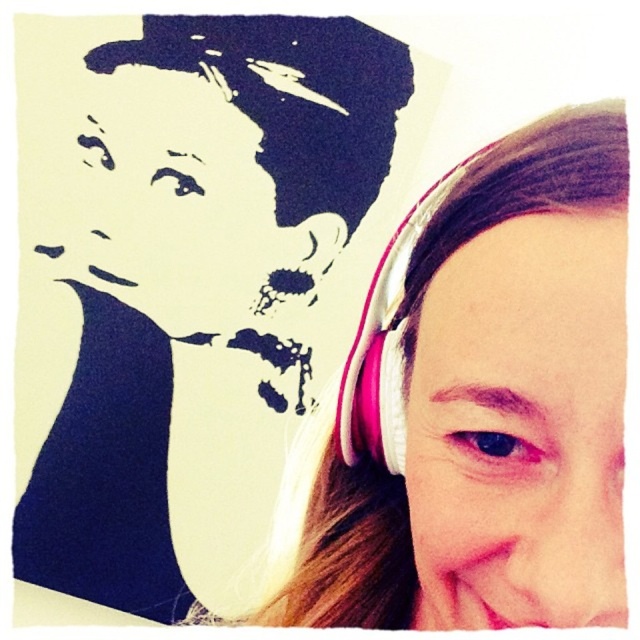
Question: Does pink matte headphones at right lie in front of pink fabric earphone at upper right?

Choices:
 (A) no
 (B) yes

Answer: (B)

Question: Where is pink fabric headphones at right located in relation to pink fabric earphone at upper right in the image?

Choices:
 (A) above
 (B) below

Answer: (A)

Question: Which of the following is the closest to the observer?

Choices:
 (A) (403, 525)
 (B) (381, 262)
 (C) (164, 310)

Answer: (B)

Question: Which object appears closest to the camera in this image?

Choices:
 (A) pink fabric headphones at right
 (B) pink fabric earphone at upper right
 (C) pink matte headphones at right

Answer: (C)

Question: Considering the relative positions of pink fabric headphones at right and pink fabric earphone at upper right in the image provided, where is pink fabric headphones at right located with respect to pink fabric earphone at upper right?

Choices:
 (A) above
 (B) below

Answer: (A)

Question: Which point appears closest to the camera in this image?

Choices:
 (A) (376, 353)
 (B) (125, 296)

Answer: (A)